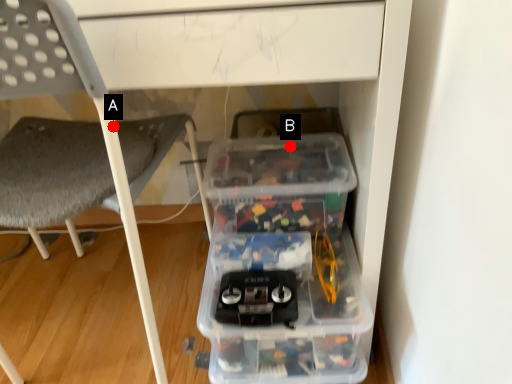
Question: Two points are circled on the image, labeled by A and B beside each circle. Which point is closer to the camera?

Choices:
 (A) A is closer
 (B) B is closer

Answer: (A)